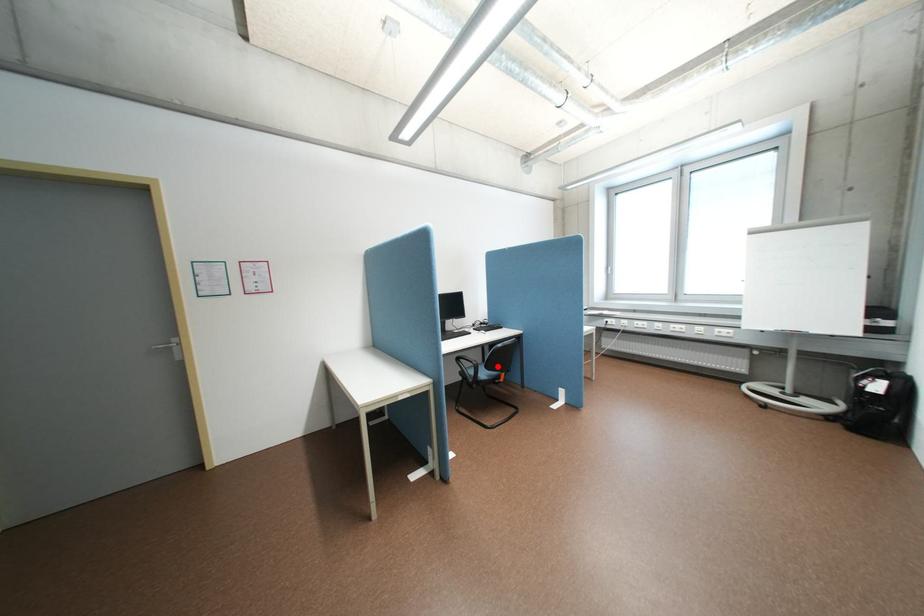
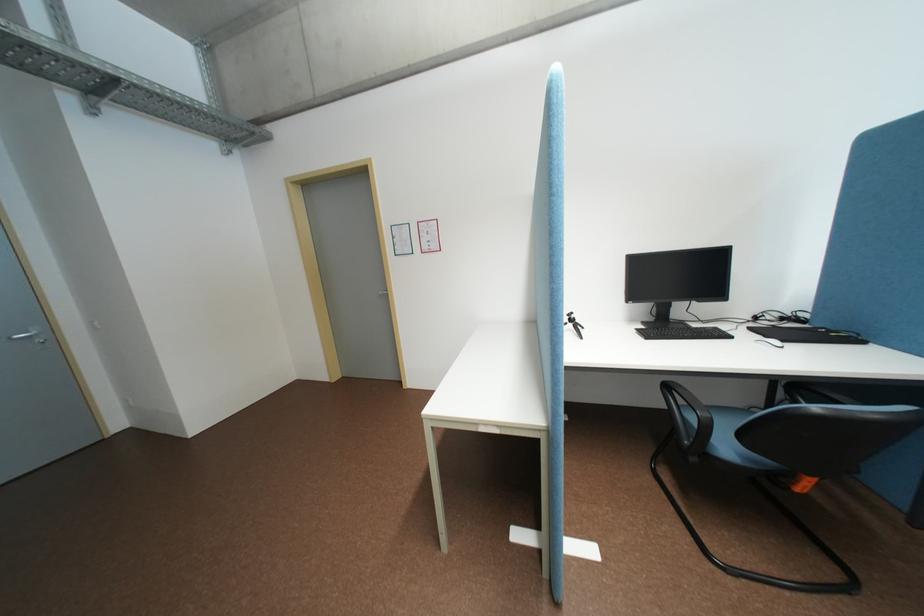
Question: I am providing you with two images of the same scene from different viewpoints. A red point is shown in image1. For the corresponding object point in image2, is it positioned nearer or farther from the camera?

Choices:
 (A) Nearer
 (B) Farther

Answer: (B)